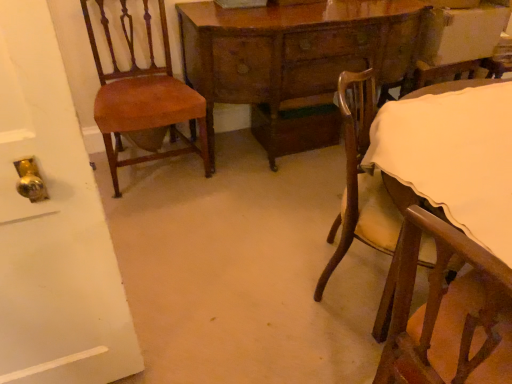
This screenshot has width=512, height=384. Identify the location of vacant area that is in front of mahogany wood chair at left, which ranks as the first chair in left-to-right order. (170, 223).